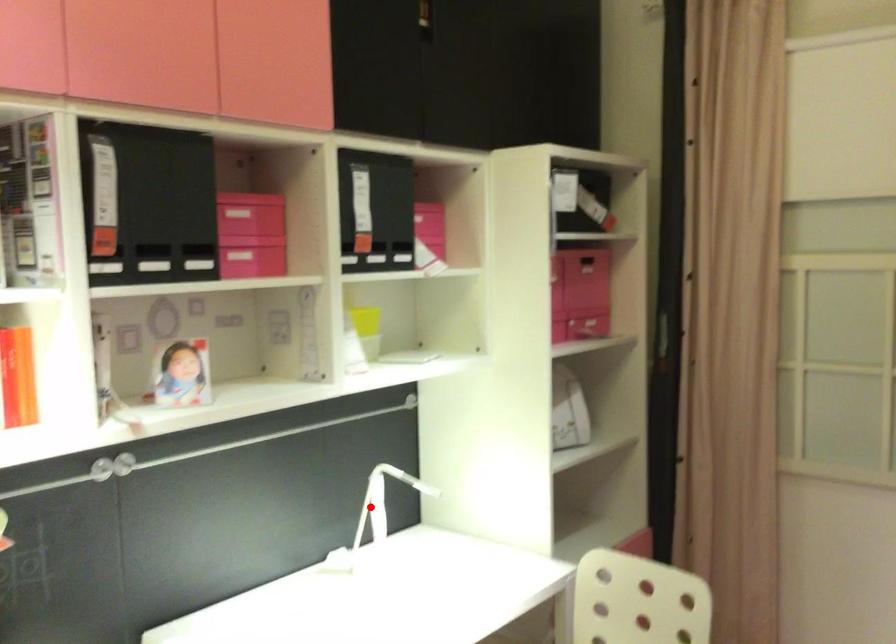
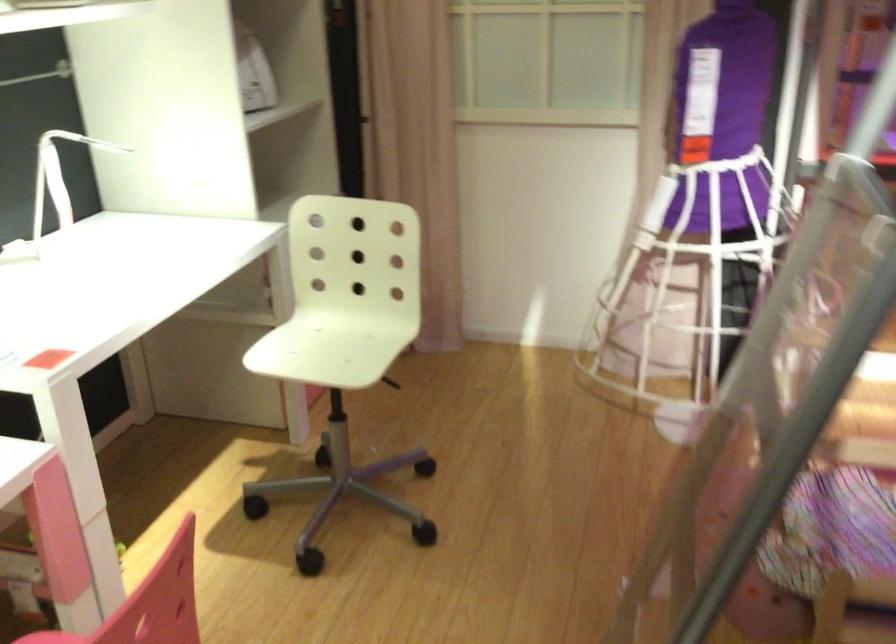
In the second image, find the point that corresponds to the highlighted location in the first image.

(58, 176)